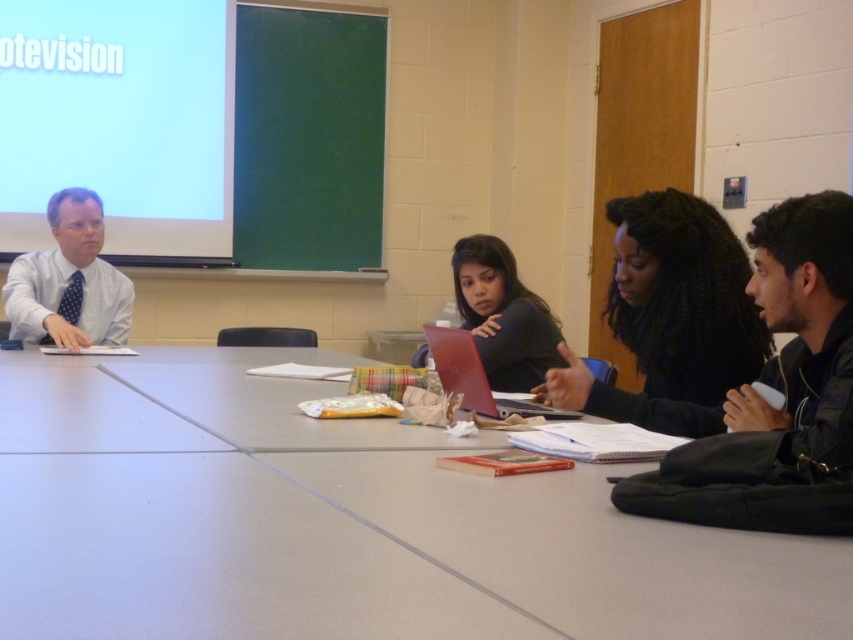
Question: Among these objects, which one is farthest from the camera?

Choices:
 (A) black leather jacket at right
 (B) matte black laptop at center
 (C) matte white shirt at left
 (D) smooth gray table at center

Answer: (C)

Question: Can you confirm if matte black laptop at center is positioned to the left of metallic silver laptop at center?

Choices:
 (A) no
 (B) yes

Answer: (B)

Question: Among these points, which one is farthest from the camera?

Choices:
 (A) (469, 378)
 (B) (610, 385)

Answer: (A)

Question: Does black leather jacket at right come in front of matte black laptop at center?

Choices:
 (A) yes
 (B) no

Answer: (A)

Question: Is black matte hair at center smaller than black leather jacket at right?

Choices:
 (A) yes
 (B) no

Answer: (B)

Question: Which of the following is the farthest from the observer?

Choices:
 (A) (584, 541)
 (B) (637, 396)

Answer: (B)